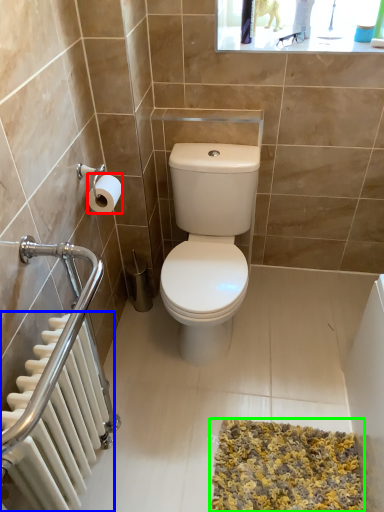
Question: Estimate the real-world distances between objects in this image. Which object is closer to toilet paper (highlighted by a red box), radiator (highlighted by a blue box) or bath mat (highlighted by a green box)?

Choices:
 (A) radiator
 (B) bath mat

Answer: (A)